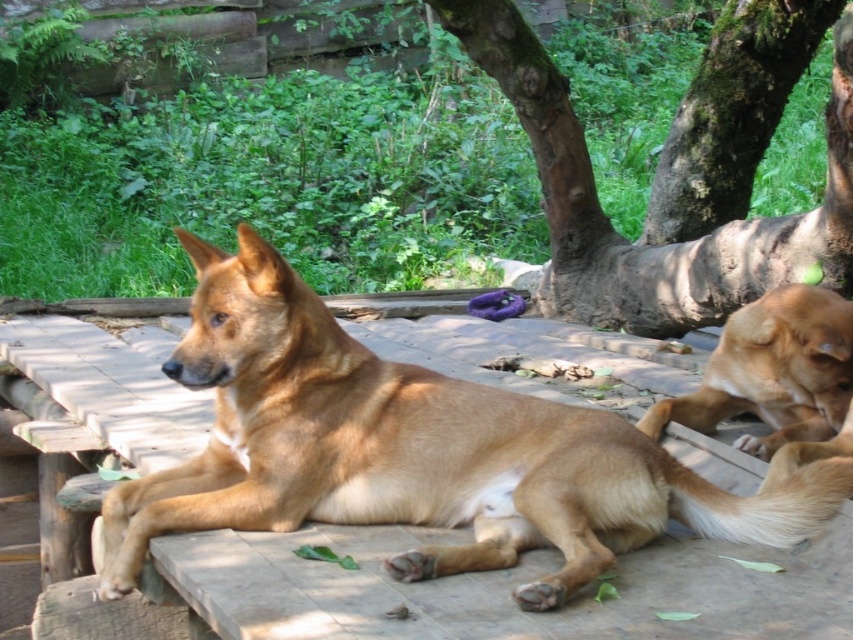
Question: Does golden fur dog at center appear on the right side of golden fur dog at right?

Choices:
 (A) yes
 (B) no

Answer: (B)

Question: Which point is farther to the camera?

Choices:
 (A) brown rough bark tree at upper center
 (B) golden fur dog at center

Answer: (A)

Question: Among these points, which one is farthest from the camera?

Choices:
 (A) (393, 499)
 (B) (577, 232)

Answer: (B)

Question: Does golden fur dog at center have a lesser width compared to brown rough bark tree at upper center?

Choices:
 (A) no
 (B) yes

Answer: (B)

Question: Does golden fur dog at center have a smaller size compared to golden fur dog at right?

Choices:
 (A) no
 (B) yes

Answer: (A)

Question: Which object is farther from the camera taking this photo?

Choices:
 (A) golden fur dog at center
 (B) golden fur dog at right

Answer: (B)